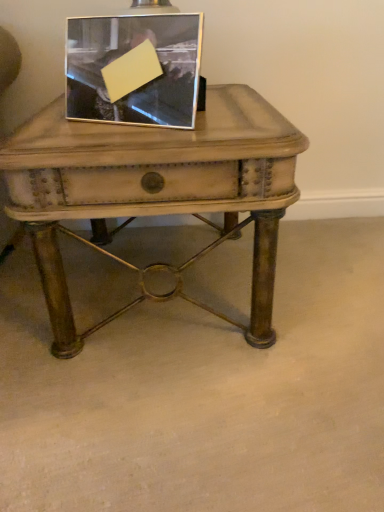
Locate an element on the screen. Image resolution: width=384 pixels, height=512 pixels. empty space that is ontop of matte wood table at center (from a real-world perspective) is located at coordinates (156, 121).